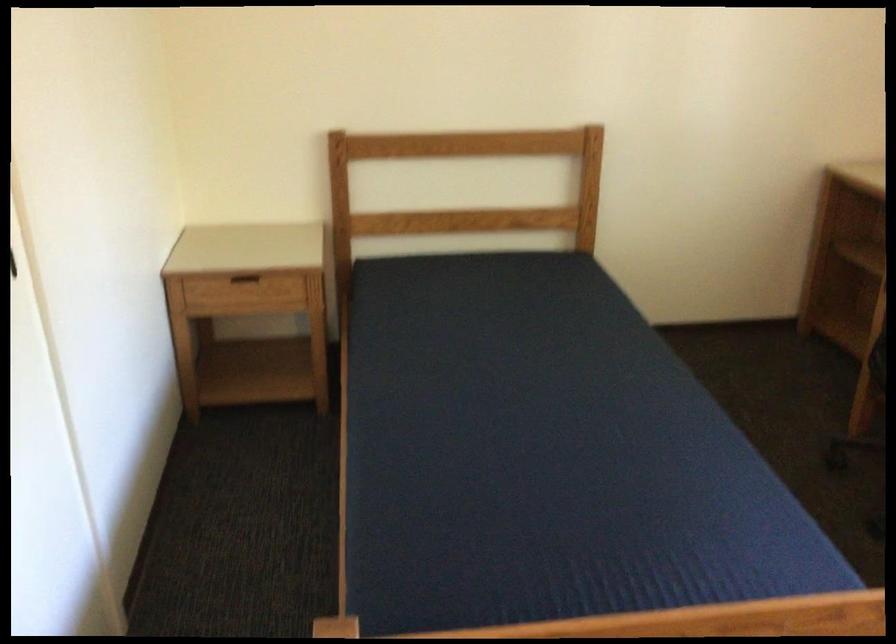
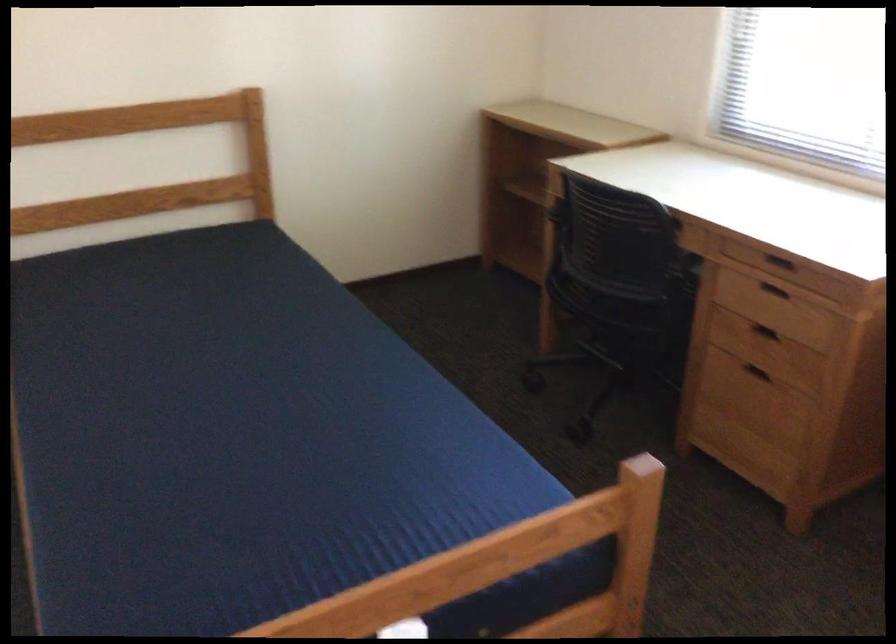
Question: The camera is either moving clockwise (left) or counter-clockwise (right) around the object. The first image is from the beginning of the video and the second image is from the end. Is the camera moving left or right when shooting the video?

Choices:
 (A) Left
 (B) Right

Answer: (A)